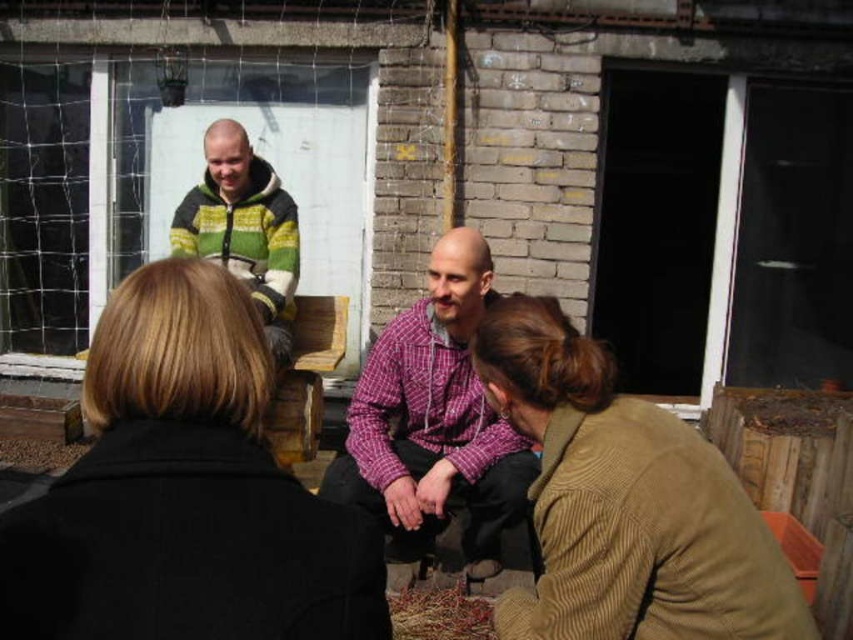
Does black wool coat at center appear on the right side of knitted wool sweater at upper left?

Correct, you'll find black wool coat at center to the right of knitted wool sweater at upper left.

Which of these two, black wool coat at center or knitted wool sweater at upper left, stands taller?

knitted wool sweater at upper left

This screenshot has height=640, width=853. Find the location of `black wool coat at center`. black wool coat at center is located at coordinates (184, 492).

Between black wool coat at center and purple checkered shirt at center, which one is positioned lower?

purple checkered shirt at center is lower down.

Who is positioned more to the left, black wool coat at center or purple checkered shirt at center?

black wool coat at center

Measure the distance between black wool coat at center and camera.

They are 29.92 inches apart.

Identify the location of black wool coat at center. This screenshot has height=640, width=853. (184, 492).

Is black wool coat at center to the right of brown corduroy jacket at lower right from the viewer's perspective?

Incorrect, black wool coat at center is not on the right side of brown corduroy jacket at lower right.

How far apart are black wool coat at center and brown corduroy jacket at lower right?

black wool coat at center and brown corduroy jacket at lower right are 28.49 inches apart.

What do you see at coordinates (184, 492) in the screenshot? This screenshot has height=640, width=853. I see `black wool coat at center` at bounding box center [184, 492].

Locate an element on the screen. This screenshot has width=853, height=640. black wool coat at center is located at coordinates (184, 492).